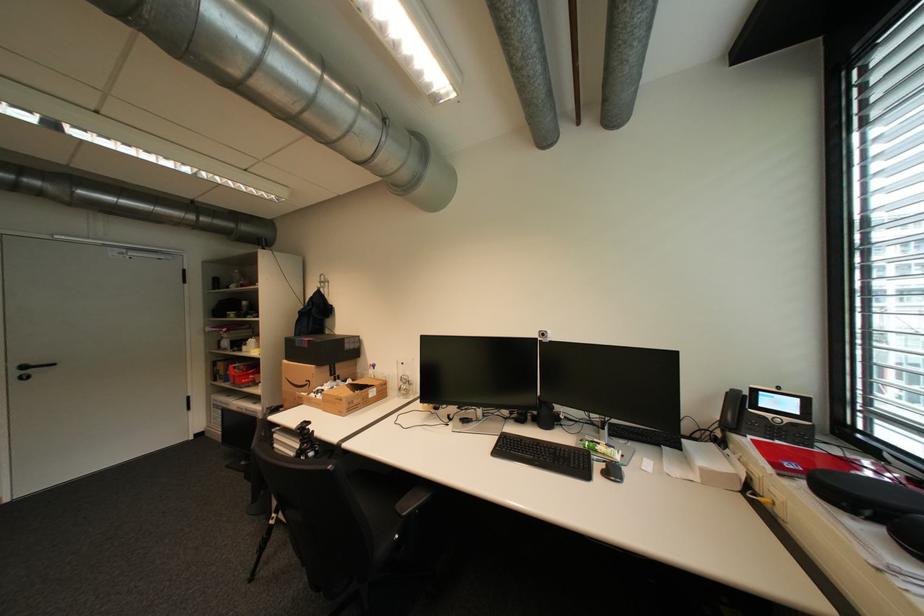
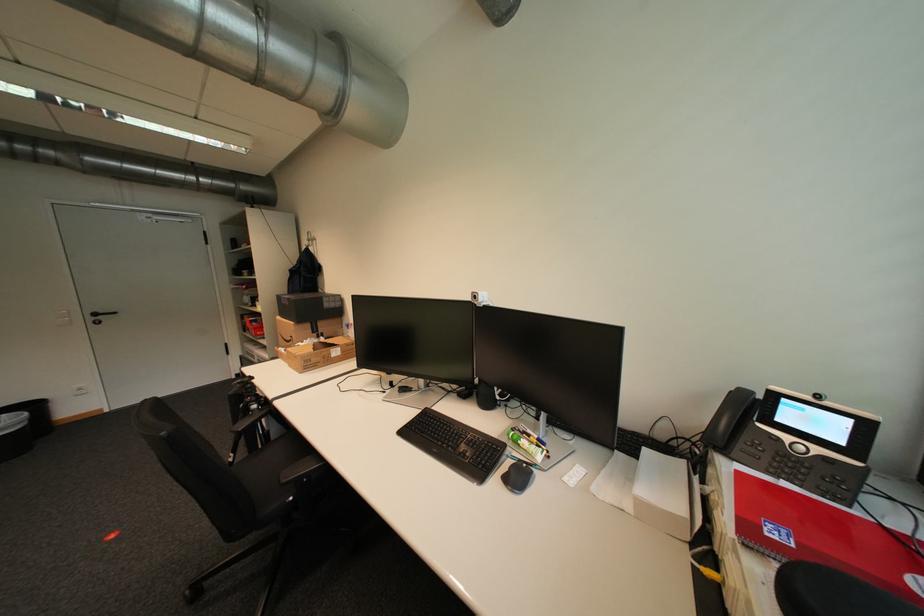
Find the pixel in the second image that matches point (806, 413) in the first image.

(850, 443)